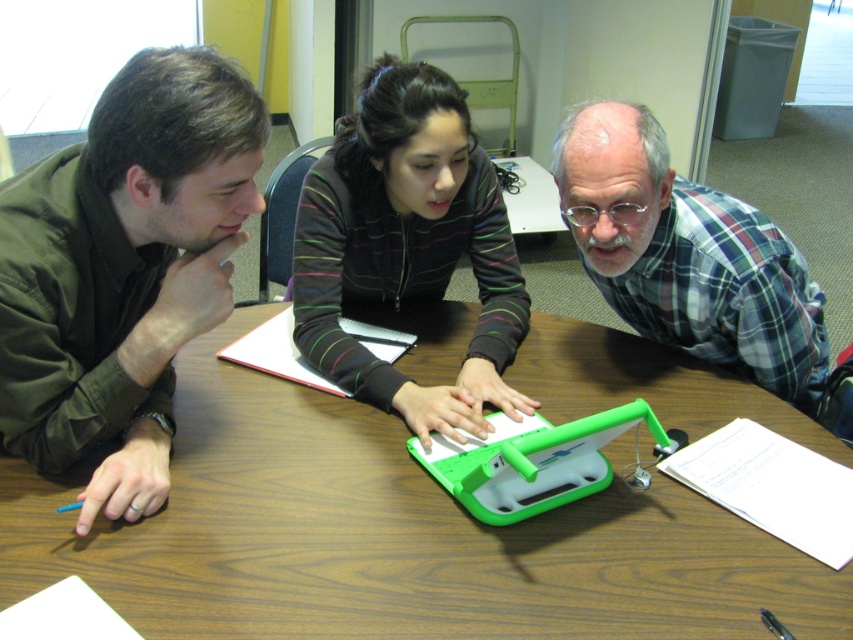
You are a photographer setting up a shoot in this scene. You need to position a spotlight so that it illuminates both the matte green shirt at left and the striped fleece jacket at center without casting shadows over other areas. Given their positions, where should you place the spotlight relative to these two objects?

The matte green shirt at left is located below the striped fleece jacket at center. To illuminate both without casting shadows, place the spotlight above and slightly behind the striped fleece jacket at center, directing light downward toward both objects.

What is located at the coordinate point (392,536) in the image?

The wooden table at center is located at the coordinate point (392,536).

You are standing in the room and want to hand a document to both the matte green shirt at left and the plaid flannel shirt at upper right. Which person would you need to reach higher to give the document to?

The matte green shirt at left is much taller than the plaid flannel shirt at upper right, so you would need to reach higher to give the document to the matte green shirt at left.